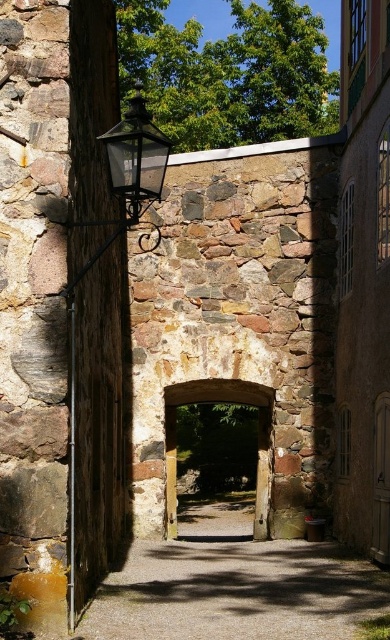
Which is in front, point (143, 250) or point (175, 397)?

Point (175, 397) is in front.

Is matte black lantern at left positioned before wooden door at center?

Yes, it is.

Between point (92, 259) and point (260, 448), which one is positioned in front?

Point (92, 259) is in front.

This screenshot has width=390, height=640. Find the location of `matte black lantern at left`. matte black lantern at left is located at coordinates (108, 248).

Who is higher up, matte black lantern at left or matte black lantern at upper left?

matte black lantern at upper left is above.

Is point (122, 179) closer to viewer compared to point (118, 196)?

Yes, point (122, 179) is closer to viewer.

At what (x,y) coordinates should I click in order to perform the action: click on matte black lantern at left. Please return your answer as a coordinate pair (x, y). This screenshot has width=390, height=640. Looking at the image, I should click on (108, 248).

What are the coordinates of `matte black lantern at left` in the screenshot? It's located at (108, 248).

Can you confirm if matte black lantern at upper left is positioned to the left of wooden door at center?

Correct, you'll find matte black lantern at upper left to the left of wooden door at center.

Locate an element on the screen. matte black lantern at upper left is located at coordinates (129, 172).

Does point (150, 141) come farther from viewer compared to point (269, 536)?

That is False.

At what (x,y) coordinates should I click in order to perform the action: click on matte black lantern at upper left. Please return your answer as a coordinate pair (x, y). Looking at the image, I should click on (129, 172).